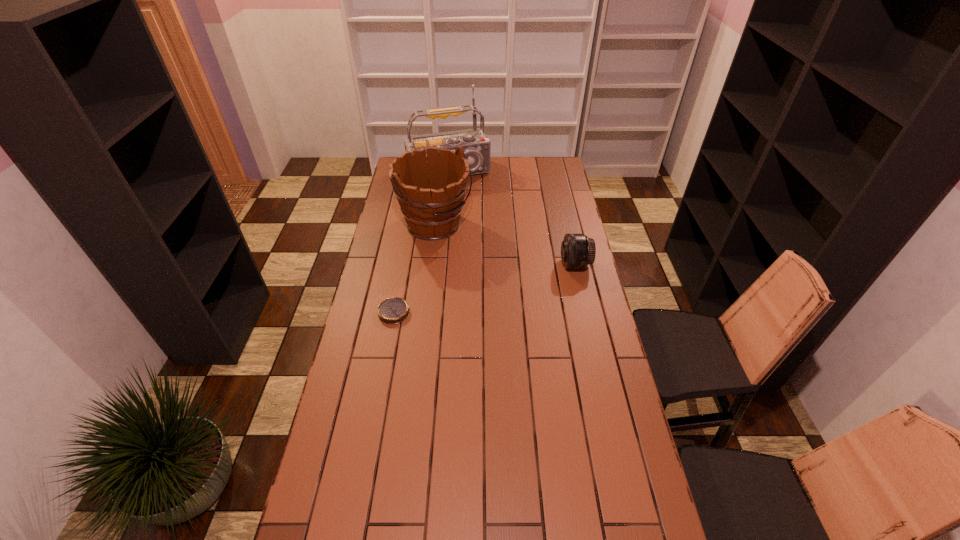
The height and width of the screenshot is (540, 960). Identify the location of vacant space situated 0.290m on the front-facing side of the second nearest object. (491, 265).

Where is `blank area located 0.190m on the front-facing side of the second nearest object`? The image size is (960, 540). blank area located 0.190m on the front-facing side of the second nearest object is located at coordinates (515, 265).

Image resolution: width=960 pixels, height=540 pixels. Find the location of `vacant space positioned with the handle on the wine bucket`. vacant space positioned with the handle on the wine bucket is located at coordinates (484, 265).

Locate an element on the screen. The height and width of the screenshot is (540, 960). free spot located with the handle on the wine bucket is located at coordinates (484, 265).

Locate an element on the screen. This screenshot has width=960, height=540. vacant area located with the handle on the wine bucket is located at coordinates (486, 266).

Where is `blank area located 0.380m on the front-facing side of the tallest object`? This screenshot has width=960, height=540. blank area located 0.380m on the front-facing side of the tallest object is located at coordinates (476, 230).

This screenshot has width=960, height=540. Identify the location of free space located on the front-facing side of the tallest object. (474, 225).

The height and width of the screenshot is (540, 960). I want to click on free spot located 0.230m on the front-facing side of the tallest object, so click(468, 211).

Where is `object that is at the far edge`? object that is at the far edge is located at coordinates (476, 146).

You are a GUI agent. You are given a task and a screenshot of the screen. Output one action in this format:
    pyautogui.click(x=<x>, y=<y>)
    Task: Click on the compass positioned at the left edge
    This screenshot has width=960, height=540.
    Given the screenshot: What is the action you would take?
    pyautogui.click(x=394, y=310)